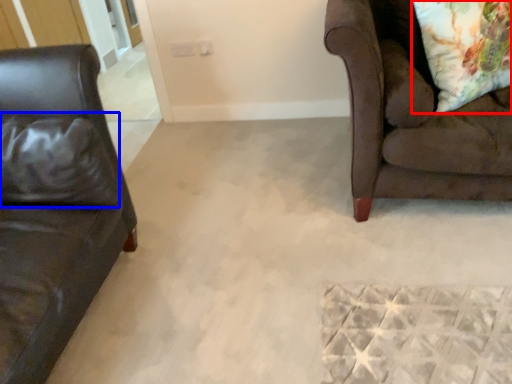
Question: Which object is further to the camera taking this photo, throw pillow (highlighted by a red box) or pillow (highlighted by a blue box)?

Choices:
 (A) throw pillow
 (B) pillow

Answer: (A)